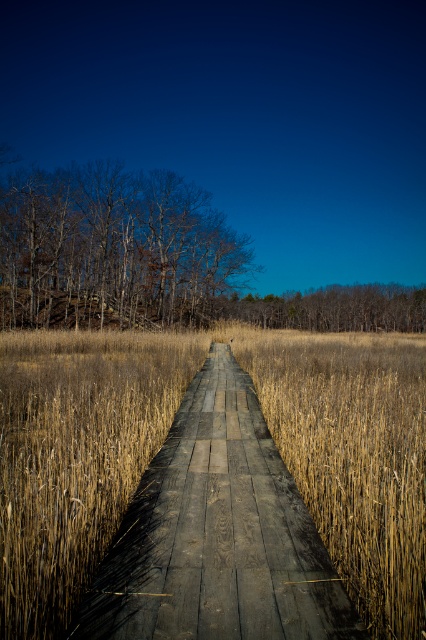
Between dark gray wooden path at center and smooth bark trees at left, which one has less height?

dark gray wooden path at center is shorter.

Which is behind, point (253, 536) or point (109, 237)?

Point (109, 237)

This screenshot has width=426, height=640. I want to click on dark gray wooden path at center, so click(218, 534).